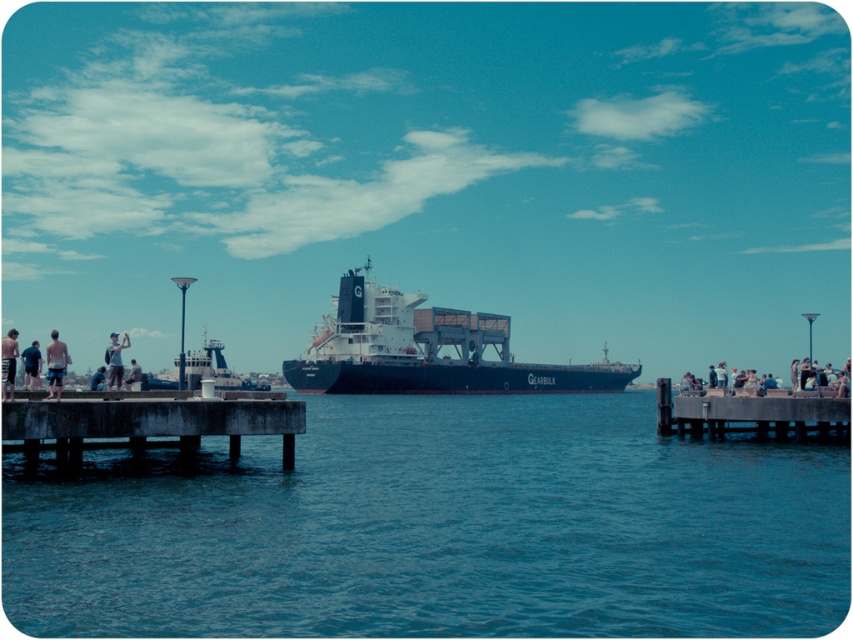
Based on the photo, you are a photographer standing on the concrete pier and you want to capture both the light blue denim jeans at right and the black shorts at left in your shot. Since you want both to be visible, which one should you focus on to ensure depth of field?

You should focus on the light blue denim jeans at right because it is taller than the black shorts at left, so focusing on the farther object will help keep both in focus.